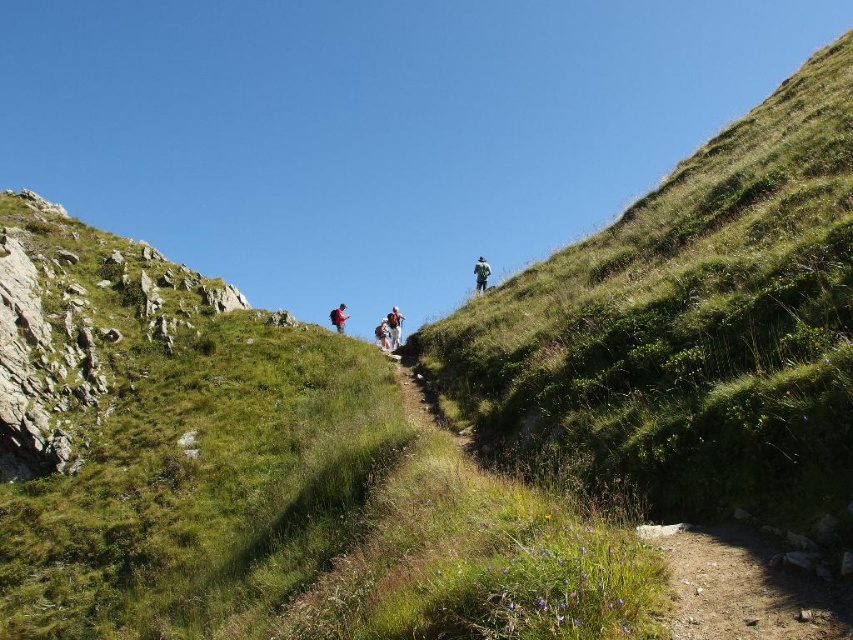
Between green grassy hillside at upper center and matte black backpack at center, which one is positioned higher?

green grassy hillside at upper center is above.

Does green grassy hillside at upper center appear on the left side of matte black backpack at center?

Incorrect, green grassy hillside at upper center is not on the left side of matte black backpack at center.

What do you see at coordinates (685, 330) in the screenshot? Image resolution: width=853 pixels, height=640 pixels. I see `green grassy hillside at upper center` at bounding box center [685, 330].

Where is `green grassy hillside at upper center`? green grassy hillside at upper center is located at coordinates (685, 330).

Does green fabric backpack at upper center appear on the right side of white fabric backpack at center?

Correct, you'll find green fabric backpack at upper center to the right of white fabric backpack at center.

Is green fabric backpack at upper center closer to the viewer compared to white fabric backpack at center?

No, it is behind white fabric backpack at center.

Locate an element on the screen. green fabric backpack at upper center is located at coordinates (480, 275).

The height and width of the screenshot is (640, 853). I want to click on green fabric backpack at upper center, so pos(480,275).

Is green grassy hillside at upper center taller than dirt path at lower right?

Indeed, green grassy hillside at upper center has a greater height compared to dirt path at lower right.

Locate an element on the screen. Image resolution: width=853 pixels, height=640 pixels. green grassy hillside at upper center is located at coordinates (685, 330).

Describe the element at coordinates (685, 330) in the screenshot. I see `green grassy hillside at upper center` at that location.

This screenshot has width=853, height=640. In order to click on green grassy hillside at upper center in this screenshot , I will do `click(685, 330)`.